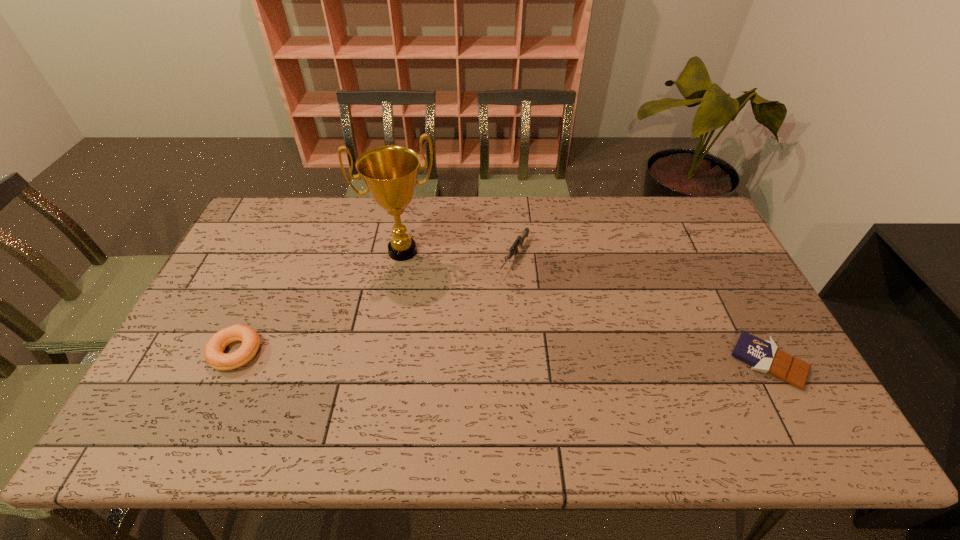
You are a GUI agent. You are given a task and a screenshot of the screen. Output one action in this format:
    pyautogui.click(x=<x>, y=<y>)
    Task: Click on the free region located aimed along the barrel of the second tallest object
    This screenshot has width=960, height=540.
    Given the screenshot: What is the action you would take?
    pyautogui.click(x=482, y=315)

Where is `free space located aimed along the barrel of the second tallest object`? Image resolution: width=960 pixels, height=540 pixels. free space located aimed along the barrel of the second tallest object is located at coordinates (490, 303).

The height and width of the screenshot is (540, 960). I want to click on vacant space located aimed along the barrel of the second tallest object, so click(496, 294).

In order to click on free spot located on the front view with handles of the tallest object in this screenshot , I will do `click(434, 352)`.

Locate an element on the screen. free point located on the front view with handles of the tallest object is located at coordinates (415, 282).

At what (x,y) coordinates should I click in order to perform the action: click on free location located 0.050m on the front view with handles of the tallest object. Please return your answer as a coordinate pair (x, y). Looking at the image, I should click on (414, 280).

Where is `gun that is at the far edge`? The height and width of the screenshot is (540, 960). gun that is at the far edge is located at coordinates (519, 241).

At what (x,y) coordinates should I click in order to perform the action: click on award at the far edge. Please return your answer as a coordinate pair (x, y). This screenshot has width=960, height=540. Looking at the image, I should click on (390, 173).

The width and height of the screenshot is (960, 540). I want to click on bagel at the near edge, so click(x=214, y=348).

Find the location of a particular element. Image resolution: width=960 pixels, height=540 pixels. chocolate bar that is at the near edge is located at coordinates (762, 355).